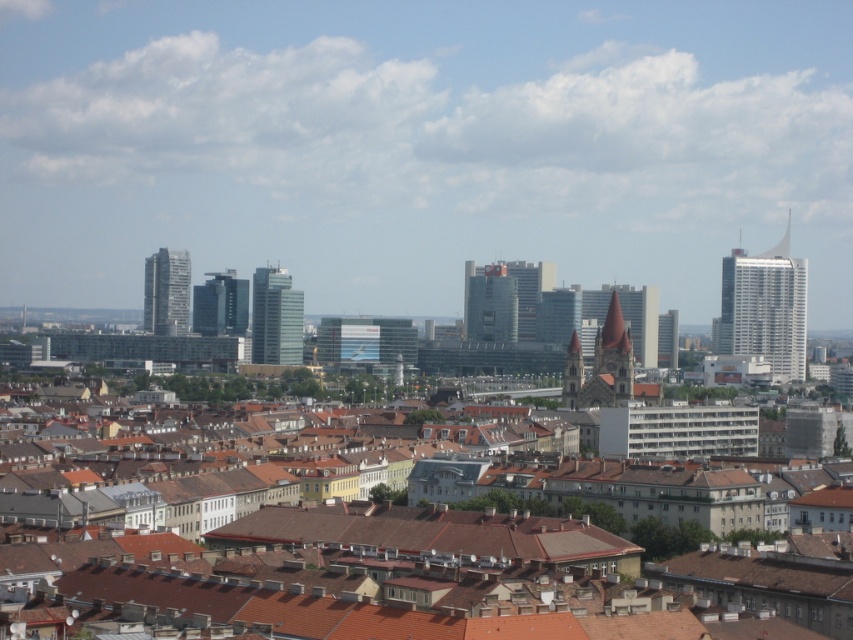
You are an urban planner evaluating the city layout. You notice the silver glass skyscraper at right and the glassy reflective building at center. Which one would cast a longer shadow during midday? Please explain your reasoning based on their positions and sizes.

The silver glass skyscraper at right is larger in size than the glassy reflective building at center. Since taller structures typically cast longer shadows, the silver glass skyscraper at right would cast a longer shadow during midday.

You are a drone operator who needs to fly your drone from the silver glass skyscraper at right to the glassy reflective building at center. Can you safely fly your drone in a straight line between them without hitting any obstacles?

The silver glass skyscraper at right is in front of the glassy reflective building at center, so there are no obstacles between them. The drone can safely fly in a straight line between them.